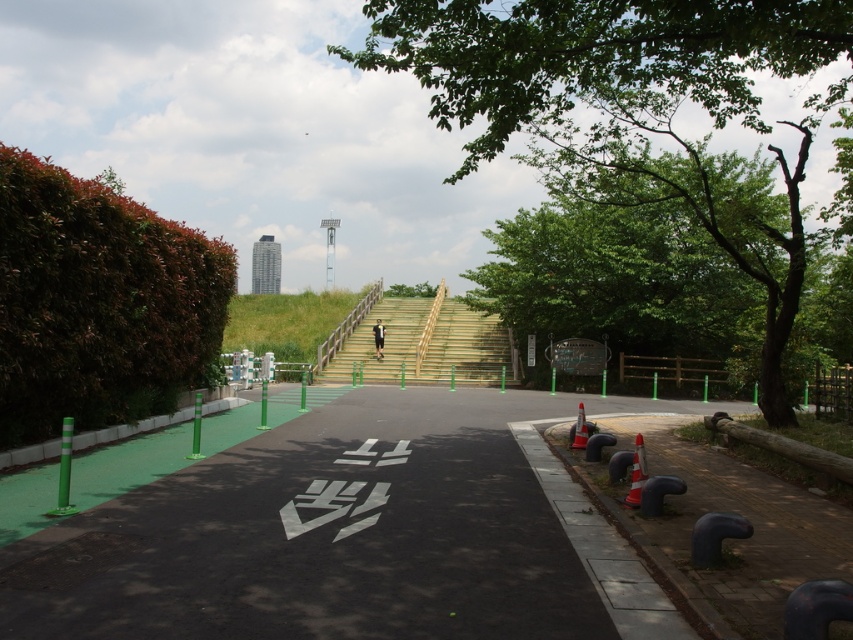
You are a delivery robot navigating the outdoor scene. You need to deliver a package to the green leafy tree at upper center. The robot has a GPS that shows your current position as point (595, 56). Is this point the correct location to start your delivery route towards the green leafy tree at upper center?

Yes, the point (595, 56) corresponds to the green leafy tree at upper center, so this is the correct starting point for your delivery route.

You are a delivery person with a cart that can only move forward. You see the black asphalt path at center and the blue rubber bollards at lower right. Which object is positioned higher in elevation?

The black asphalt path at center is located above the blue rubber bollards at lower right, so the black asphalt path at center is higher in elevation.